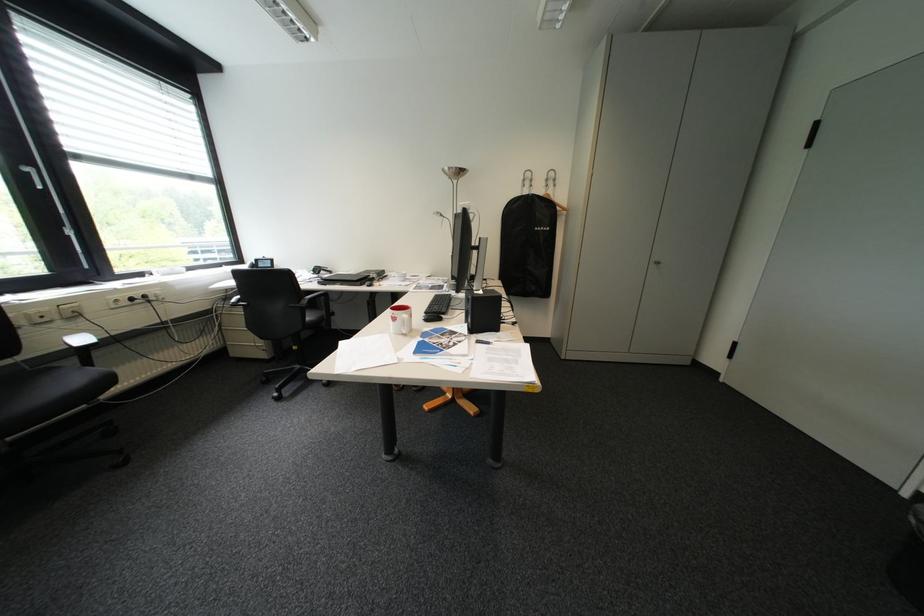
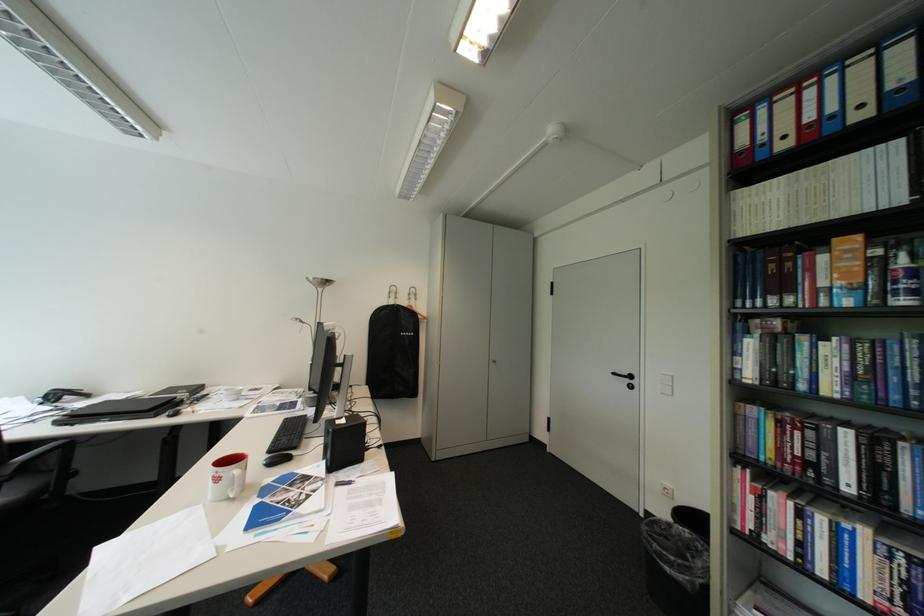
Where in the second image is the point corresponding to [543,180] from the first image?

(408, 294)